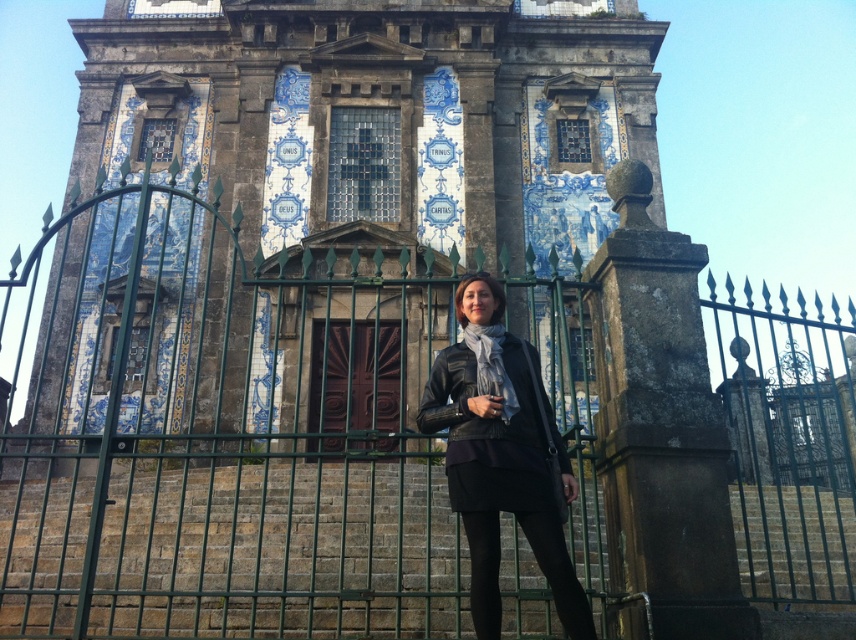
Based on the photo, does blue glazed tiles at center have a smaller size compared to black leather jacket at center?

Actually, blue glazed tiles at center might be larger than black leather jacket at center.

Is point (298, 61) farther from camera compared to point (556, 592)?

Yes, point (298, 61) is farther from viewer.

The width and height of the screenshot is (856, 640). Find the location of `blue glazed tiles at center`. blue glazed tiles at center is located at coordinates (360, 257).